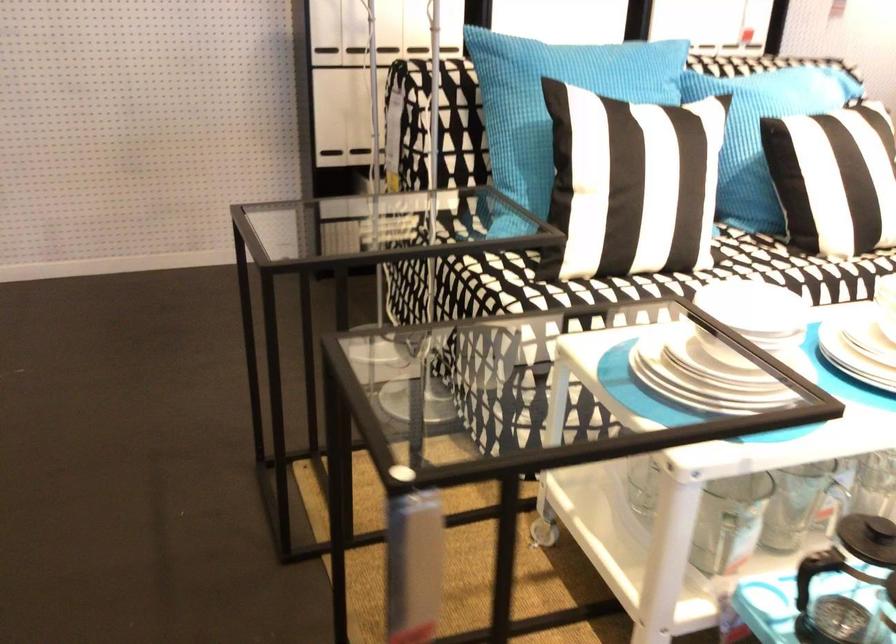
Find where to sit the sofa sitting surface. Please return your answer as a coordinate pair (x, y).

(782, 263)